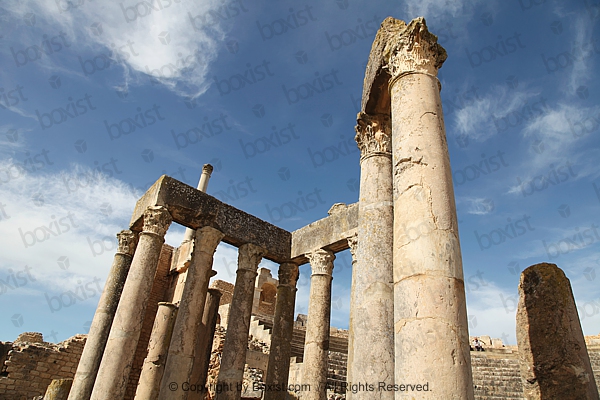
Find the location of a particular element. pillar is located at coordinates (416, 337).